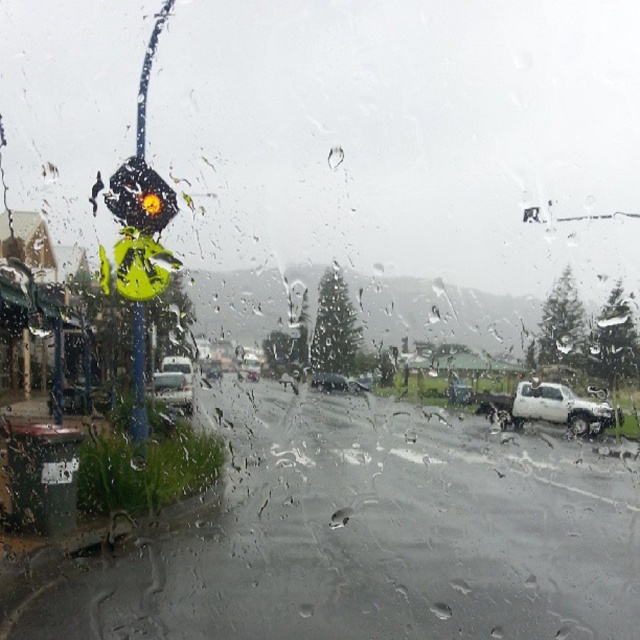
Which of these two, matte black stop light at upper left or shiny silver sedan at center, stands shorter?

With less height is shiny silver sedan at center.

Is point (113, 188) positioned behind point (237, 369)?

No.

Image resolution: width=640 pixels, height=640 pixels. Identify the location of matte black stop light at upper left. (140, 196).

Is silver metallic sedan at center below metallic silver sedan at center?

Incorrect, silver metallic sedan at center is not positioned below metallic silver sedan at center.

Based on the photo, who is taller, silver metallic sedan at center or metallic silver sedan at center?

metallic silver sedan at center is taller.

Between point (170, 397) and point (451, 385), which one is positioned in front?

Point (170, 397) is in front.

Where is `silver metallic sedan at center`? silver metallic sedan at center is located at coordinates (172, 390).

Is silver metallic sedan at center behind shiny black sedan at center?

That is False.

Does silver metallic sedan at center appear over shiny black sedan at center?

Correct, silver metallic sedan at center is located above shiny black sedan at center.

Is point (157, 388) behind point (342, 381)?

That is False.

Identify the location of silver metallic sedan at center. (172, 390).